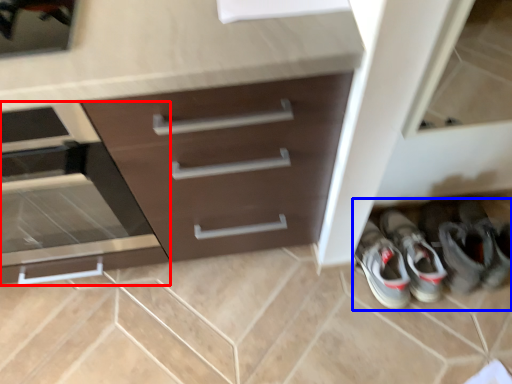
Question: Which point is closer to the camera, drawer (highlighted by a red box) or footwear (highlighted by a blue box)?

Choices:
 (A) drawer
 (B) footwear

Answer: (A)